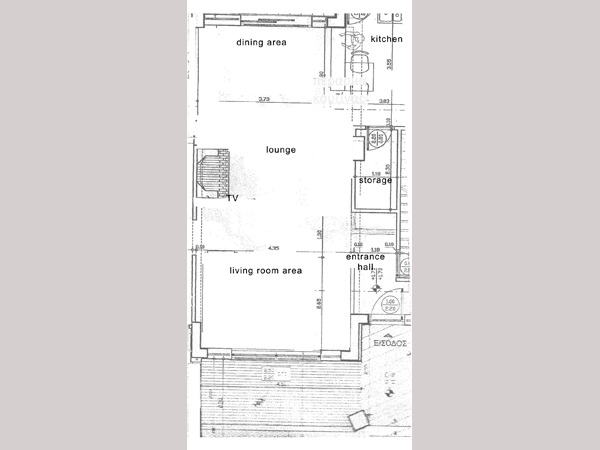
Image resolution: width=600 pixels, height=450 pixels. What are the coordinates of `lounge` in the screenshot? It's located at 278,147.